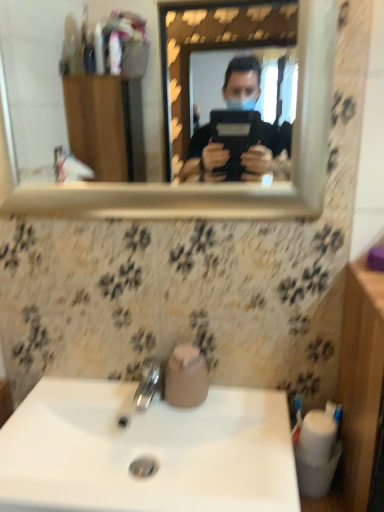
Question: From the image's perspective, is polished chrome tap at center over white glossy sink at lower center?

Choices:
 (A) yes
 (B) no

Answer: (A)

Question: Considering the relative sizes of polished chrome tap at center and white glossy sink at lower center in the image provided, is polished chrome tap at center bigger than white glossy sink at lower center?

Choices:
 (A) no
 (B) yes

Answer: (A)

Question: From a real-world perspective, does polished chrome tap at center stand above white glossy sink at lower center?

Choices:
 (A) no
 (B) yes

Answer: (B)

Question: From the image's perspective, is polished chrome tap at center below white glossy sink at lower center?

Choices:
 (A) yes
 (B) no

Answer: (B)

Question: Is polished chrome tap at center positioned with its back to white glossy sink at lower center?

Choices:
 (A) yes
 (B) no

Answer: (B)

Question: Considering the relative sizes of polished chrome tap at center and white glossy sink at lower center in the image provided, is polished chrome tap at center thinner than white glossy sink at lower center?

Choices:
 (A) no
 (B) yes

Answer: (B)

Question: Is polished chrome tap at center not near pink matte toilet paper at sink?

Choices:
 (A) yes
 (B) no

Answer: (B)

Question: Can you confirm if polished chrome tap at center is thinner than pink matte toilet paper at sink?

Choices:
 (A) yes
 (B) no

Answer: (B)

Question: Considering the relative sizes of polished chrome tap at center and pink matte toilet paper at sink in the image provided, is polished chrome tap at center smaller than pink matte toilet paper at sink?

Choices:
 (A) no
 (B) yes

Answer: (B)

Question: From the image's perspective, is polished chrome tap at center beneath pink matte toilet paper at sink?

Choices:
 (A) yes
 (B) no

Answer: (A)

Question: Is polished chrome tap at center looking in the opposite direction of pink matte toilet paper at sink?

Choices:
 (A) no
 (B) yes

Answer: (A)

Question: Is polished chrome tap at center behind pink matte toilet paper at sink?

Choices:
 (A) yes
 (B) no

Answer: (B)

Question: From a real-world perspective, is gold-framed mirror at upper center below pink matte toilet paper at sink?

Choices:
 (A) yes
 (B) no

Answer: (B)